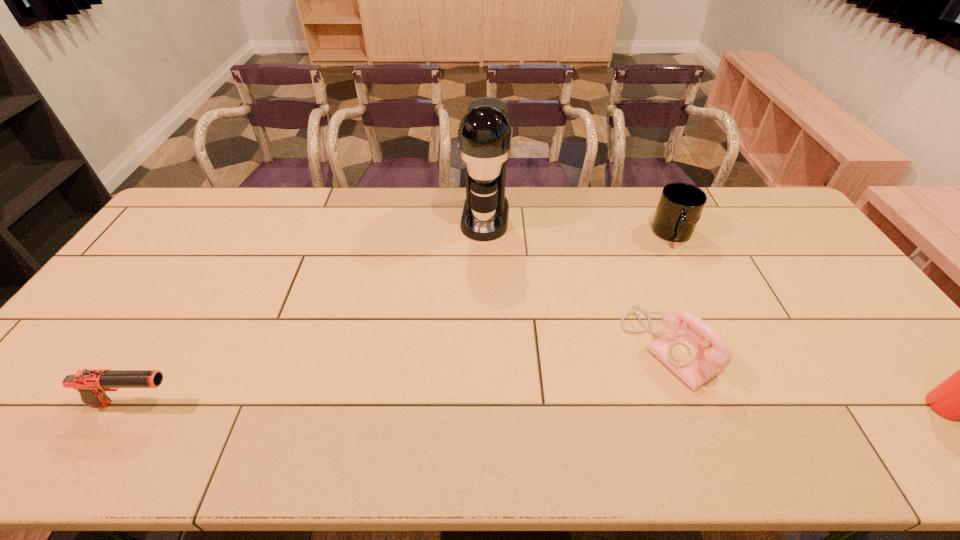
You are a GUI agent. You are given a task and a screenshot of the screen. Output one action in this format:
    pyautogui.click(x=<x>, y=<y>)
    Task: Click on the blank area at the near edge
    The height and width of the screenshot is (540, 960).
    Given the screenshot: What is the action you would take?
    pyautogui.click(x=437, y=407)

Locate an element on the screen. vacant area at the right edge is located at coordinates (802, 272).

Identify the location of vacant space at the far left corner of the desktop. (180, 218).

Image resolution: width=960 pixels, height=540 pixels. In order to click on vacant space at the near left corner of the desktop in this screenshot , I will do `click(28, 393)`.

Identify the location of vacant area between the telephone and the gun. The width and height of the screenshot is (960, 540). (402, 375).

In order to click on free space between the coffee maker and the gun in this screenshot , I will do `click(310, 310)`.

Locate an element on the screen. This screenshot has width=960, height=540. free point between the coffee maker and the gun is located at coordinates (310, 310).

Locate an element on the screen. The width and height of the screenshot is (960, 540). blank region between the tallest object and the leftmost object is located at coordinates point(310,310).

I want to click on free point between the tallest object and the gun, so click(310, 310).

Locate an element on the screen. Image resolution: width=960 pixels, height=540 pixels. free space between the leftmost object and the mug is located at coordinates (404, 319).